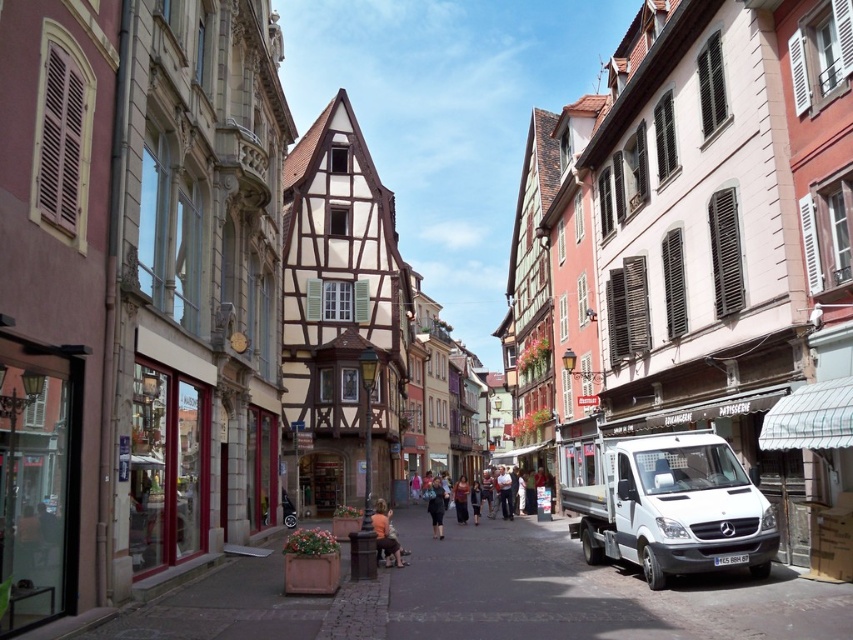
You are a pedestrian standing on the cobblestone street. You see a white metallic van at lower right and dark blue jeans at center. Which object is wider?

The white metallic van at lower right is wider than the dark blue jeans at center.

You are a delivery person who needs to park your white metallic van at lower right in a spot that is exactly as wide as your van. There is a dark brown leather jacket at center currently occupying part of the parking space. Can you park your van without overlapping the jacket?

The white metallic van at lower right is wider than the dark brown leather jacket at center. Since the parking spot is exactly as wide as the van, the jacket is narrower and would not fit in the space allocated for the van. Therefore, you can park the van without overlapping the jacket as long as you position it properly within the designated area.